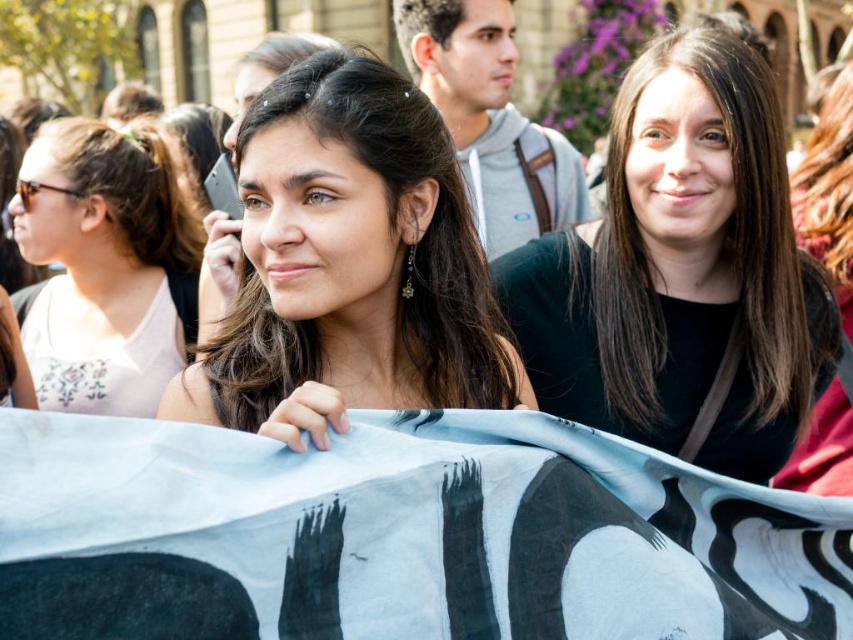
Question: Is matte black phone at center to the left of white fabric at left from the viewer's perspective?

Choices:
 (A) no
 (B) yes

Answer: (A)

Question: Is black matte shirt at center positioned before white fabric at left?

Choices:
 (A) no
 (B) yes

Answer: (B)

Question: Among these points, which one is farthest from the camera?

Choices:
 (A) (563, 372)
 (B) (451, 321)

Answer: (A)

Question: Which of the following is the farthest from the observer?

Choices:
 (A) (457, 230)
 (B) (495, 282)

Answer: (B)

Question: Does black matte shirt at center appear on the right side of white fabric at left?

Choices:
 (A) yes
 (B) no

Answer: (A)

Question: Which point appears farthest from the camera in this image?

Choices:
 (A) (56, 328)
 (B) (608, 160)
 (C) (437, 176)

Answer: (A)